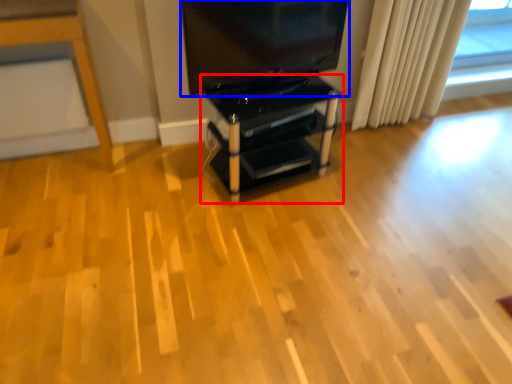
Question: Which object is further to the camera taking this photo, furniture (highlighted by a red box) or television (highlighted by a blue box)?

Choices:
 (A) furniture
 (B) television

Answer: (A)